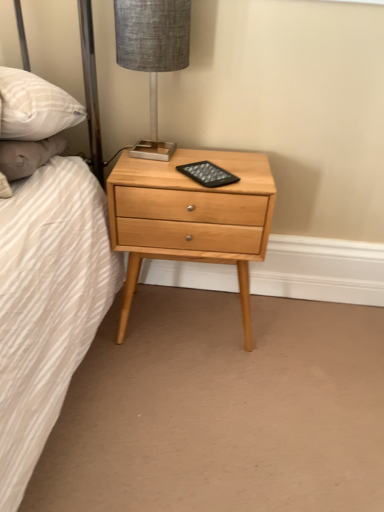
What do you see at coordinates (191, 217) in the screenshot?
I see `natural wood nightstand at center` at bounding box center [191, 217].

The width and height of the screenshot is (384, 512). I want to click on natural wood nightstand at center, so click(191, 217).

Locate an element on the screen. textured gray fabric lampshade at upper center is located at coordinates (152, 53).

What is the approximate width of textured gray fabric lampshade at upper center?

textured gray fabric lampshade at upper center is 8.67 inches in width.

This screenshot has width=384, height=512. What do you see at coordinates (152, 53) in the screenshot? I see `textured gray fabric lampshade at upper center` at bounding box center [152, 53].

At what (x,y) coordinates should I click in order to perform the action: click on natural wood nightstand at center. Please return your answer as a coordinate pair (x, y). Image resolution: width=384 pixels, height=512 pixels. Looking at the image, I should click on (191, 217).

In the image, is textured gray fabric lampshade at upper center on the left side or the right side of natural wood nightstand at center?

From the image, it's evident that textured gray fabric lampshade at upper center is to the left of natural wood nightstand at center.

Which object is further away from the camera taking this photo, textured gray fabric lampshade at upper center or natural wood nightstand at center?

Positioned behind is natural wood nightstand at center.

Is point (121, 60) positioned before point (172, 242)?

Yes.

From the image's perspective, relative to natural wood nightstand at center, is textured gray fabric lampshade at upper center above or below?

Based on their image positions, textured gray fabric lampshade at upper center is located above natural wood nightstand at center.

From a real-world perspective, is textured gray fabric lampshade at upper center physically located above or below natural wood nightstand at center?

textured gray fabric lampshade at upper center is situated higher than natural wood nightstand at center in the real world.

Can you confirm if textured gray fabric lampshade at upper center is thinner than natural wood nightstand at center?

Yes.

Considering the sizes of textured gray fabric lampshade at upper center and natural wood nightstand at center in the image, is textured gray fabric lampshade at upper center taller or shorter than natural wood nightstand at center?

In the image, textured gray fabric lampshade at upper center appears to be shorter than natural wood nightstand at center.

Which of these two, textured gray fabric lampshade at upper center or natural wood nightstand at center, is smaller?

Smaller between the two is textured gray fabric lampshade at upper center.

Does textured gray fabric lampshade at upper center contain natural wood nightstand at center?

No, natural wood nightstand at center is not inside textured gray fabric lampshade at upper center.

Are textured gray fabric lampshade at upper center and natural wood nightstand at center making contact?

textured gray fabric lampshade at upper center and natural wood nightstand at center are not in contact.

Could you tell me if textured gray fabric lampshade at upper center is turned towards natural wood nightstand at center?

No, textured gray fabric lampshade at upper center is not aimed at natural wood nightstand at center.

How many degrees apart are the facing directions of textured gray fabric lampshade at upper center and natural wood nightstand at center?

5.96 degrees.

Locate an element on the screen. The image size is (384, 512). table lamp above the natural wood nightstand at center (from the image's perspective) is located at coordinates (152, 53).

Does natural wood nightstand at center appear on the left side of textured gray fabric lampshade at upper center?

No, natural wood nightstand at center is not to the left of textured gray fabric lampshade at upper center.

Does natural wood nightstand at center come behind textured gray fabric lampshade at upper center?

Yes, natural wood nightstand at center is further from the camera.

Does point (133, 189) lie in front of point (172, 13)?

No, (133, 189) is further to viewer.

In the scene shown: From the image's perspective, which is below, natural wood nightstand at center or textured gray fabric lampshade at upper center?

natural wood nightstand at center, from the image's perspective.

From a real-world perspective, relative to textured gray fabric lampshade at upper center, is natural wood nightstand at center vertically above or below?

Clearly, from a real-world perspective, natural wood nightstand at center is below textured gray fabric lampshade at upper center.

Can you confirm if natural wood nightstand at center is thinner than textured gray fabric lampshade at upper center?

No, natural wood nightstand at center is not thinner than textured gray fabric lampshade at upper center.

Does natural wood nightstand at center have a lesser height compared to textured gray fabric lampshade at upper center?

No, natural wood nightstand at center is not shorter than textured gray fabric lampshade at upper center.

Between natural wood nightstand at center and textured gray fabric lampshade at upper center, which one has smaller size?

With smaller size is textured gray fabric lampshade at upper center.

Is natural wood nightstand at center inside or outside of textured gray fabric lampshade at upper center?

natural wood nightstand at center is not inside textured gray fabric lampshade at upper center, it's outside.

Are natural wood nightstand at center and textured gray fabric lampshade at upper center located far from each other?

No, there isn't a large distance between natural wood nightstand at center and textured gray fabric lampshade at upper center.

Is natural wood nightstand at center facing away from textured gray fabric lampshade at upper center?

No.

Locate an element on the screen. This screenshot has width=384, height=512. table lamp that is above the natural wood nightstand at center (from a real-world perspective) is located at coordinates (152, 53).

Identify the location of table lamp on the left of natural wood nightstand at center. (152, 53).

The width and height of the screenshot is (384, 512). Identify the location of nightstand directly beneath the textured gray fabric lampshade at upper center (from a real-world perspective). (191, 217).